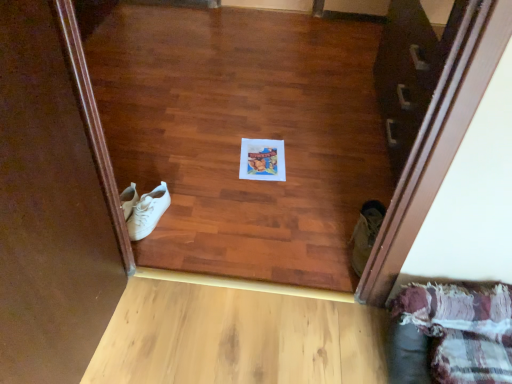
Find the location of a particular element. empty space that is to the right of white leather sneakers at left, placed as the 1th footwear when sorted from left to right is located at coordinates (196, 222).